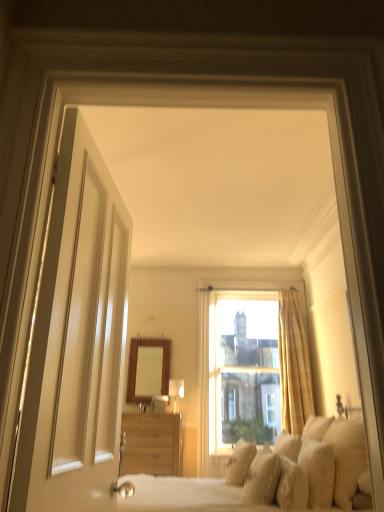
This screenshot has height=512, width=384. In order to click on white soft pillow at lower right, the 4th pillow viewed from the left in this screenshot , I will do `click(288, 445)`.

Where is `fluffy white pillow at lower center, arranged as the 6th pillow when viewed from the right`? This screenshot has width=384, height=512. fluffy white pillow at lower center, arranged as the 6th pillow when viewed from the right is located at coordinates (240, 462).

Looking at this image, how much space does white textured pillow at lower right, the 2th pillow in the right-to-left sequence, occupy horizontally?

The width of white textured pillow at lower right, the 2th pillow in the right-to-left sequence, is 8.10 inches.

What is the approximate height of soft cream pillows at center?

It is 3.51 feet.

Describe the element at coordinates (152, 444) in the screenshot. Image resolution: width=384 pixels, height=512 pixels. I see `wooden cabinet at lower center` at that location.

In order to face wooden cabinet at lower center, should I rotate leftwards or rightwards?

Turn left approximately 5.946 degrees to face it.

This screenshot has width=384, height=512. I want to click on white soft pillow at lower right, arranged as the 3th pillow when viewed from the right, so click(288, 445).

In the scene shown: Considering the positions of objects white glossy door at left and wooden frame mirror at center in the image provided, who is more to the right, white glossy door at left or wooden frame mirror at center?

From the viewer's perspective, white glossy door at left appears more on the right side.

Would you consider white glossy door at left to be distant from wooden frame mirror at center?

Yes.

From a real-world perspective, which is physically above, white glossy door at left or wooden frame mirror at center?

In real-world perspective, wooden frame mirror at center is above.

There is a fluffy white pillow at lower center, acting as the 1th pillow starting from the left. Identify the location of the 2nd pillow below it (from a real-world perspective). This screenshot has width=384, height=512. coord(292,486).

How distant is fluffy white pillow at lower right, which is counted as the 4th pillow, starting from the right, from fluffy white pillow at lower center, arranged as the 6th pillow when viewed from the right?

fluffy white pillow at lower right, which is counted as the 4th pillow, starting from the right, is 26.13 inches away from fluffy white pillow at lower center, arranged as the 6th pillow when viewed from the right.

How different are the orientations of fluffy white pillow at lower right, which is counted as the 4th pillow, starting from the right, and fluffy white pillow at lower center, arranged as the 6th pillow when viewed from the right, in degrees?

There is a 0.00278-degree angle between the facing directions of fluffy white pillow at lower right, which is counted as the 4th pillow, starting from the right, and fluffy white pillow at lower center, arranged as the 6th pillow when viewed from the right.

Considering the positions of objects fluffy white pillow at lower right, which is counted as the 4th pillow, starting from the right, and fluffy white pillow at lower center, arranged as the 6th pillow when viewed from the right, in the image provided, who is behind, fluffy white pillow at lower right, which is counted as the 4th pillow, starting from the right, or fluffy white pillow at lower center, arranged as the 6th pillow when viewed from the right,?

fluffy white pillow at lower center, arranged as the 6th pillow when viewed from the right, is more distant.

In the scene shown: Which object is positioned more to the left, white textured pillow at lower right, the 2th pillow in the right-to-left sequence, or soft white pillow at lower right, which is counted as the first pillow, starting from the right?

white textured pillow at lower right, the 2th pillow in the right-to-left sequence, is more to the left.

Is soft white pillow at lower right, the sixth pillow positioned from the left, inside white textured pillow at lower right, the 2th pillow in the right-to-left sequence?

That's incorrect, soft white pillow at lower right, the sixth pillow positioned from the left, is not inside white textured pillow at lower right, the 2th pillow in the right-to-left sequence.

Is white textured pillow at lower right, positioned as the fifth pillow in left-to-right order, closer to camera compared to soft white pillow at lower right, which is counted as the first pillow, starting from the right?

No, white textured pillow at lower right, positioned as the fifth pillow in left-to-right order, is further to the viewer.

Is white textured pillow at lower right, the 2th pillow in the right-to-left sequence, taller or shorter than soft white pillow at lower right, the sixth pillow positioned from the left?

white textured pillow at lower right, the 2th pillow in the right-to-left sequence, is taller than soft white pillow at lower right, the sixth pillow positioned from the left.

Does soft cream pillows at center turn towards matte white lampshade at center?

→ No, soft cream pillows at center does not turn towards matte white lampshade at center.

Would you say matte white lampshade at center is part of soft cream pillows at center's contents?

Actually, matte white lampshade at center is outside soft cream pillows at center.

Is soft cream pillows at center bigger than matte white lampshade at center?

Indeed, soft cream pillows at center has a larger size compared to matte white lampshade at center.

Which is closer, (264, 496) or (174, 384)?

The point (264, 496) is more forward.

Is point (294, 437) closer or farther from the camera than point (349, 484)?

Point (294, 437) is farther from the camera than point (349, 484).

Is white soft pillow at lower right, the 4th pillow viewed from the left, not close to soft white pillow at lower right, the sixth pillow positioned from the left?

They are positioned close to each other.

Is soft white pillow at lower right, which is counted as the first pillow, starting from the right, surrounded by white soft pillow at lower right, arranged as the 3th pillow when viewed from the right?

Actually, soft white pillow at lower right, which is counted as the first pillow, starting from the right, is outside white soft pillow at lower right, arranged as the 3th pillow when viewed from the right.

From a real-world perspective, between wooden frame mirror at center and wooden cabinet at lower center, who is vertically higher?

wooden frame mirror at center, from a real-world perspective.

From the image's perspective, is wooden frame mirror at center over wooden cabinet at lower center?

Yes, from the image's perspective, wooden frame mirror at center is above wooden cabinet at lower center.

How different are the orientations of wooden frame mirror at center and wooden cabinet at lower center in degrees?

There is a 2.58-degree angle between the facing directions of wooden frame mirror at center and wooden cabinet at lower center.

Would you say wooden frame mirror at center is inside or outside wooden cabinet at lower center?

wooden frame mirror at center is not inside wooden cabinet at lower center, it's outside.

Locate an element on the screen. The height and width of the screenshot is (512, 384). the 5th pillow to the right when counting from the wooden frame mirror at center is located at coordinates (318, 472).

Between white textured pillow at lower right, positioned as the fifth pillow in left-to-right order, and wooden frame mirror at center, which one is positioned behind?

wooden frame mirror at center is behind.

Is point (317, 473) positioned in front of point (144, 381)?

Yes, it is in front of point (144, 381).

Who is bigger, white textured pillow at lower right, positioned as the fifth pillow in left-to-right order, or wooden frame mirror at center?

With larger size is wooden frame mirror at center.

Locate an element on the screen. door that appears below the wooden frame mirror at center (from a real-world perspective) is located at coordinates (78, 328).

Where is `the 2nd pillow to the right when counting from the fluffy white pillow at lower center, acting as the 1th pillow starting from the left`? the 2nd pillow to the right when counting from the fluffy white pillow at lower center, acting as the 1th pillow starting from the left is located at coordinates (292, 486).

Estimate the real-world distances between objects in this image. Which object is further from clear glass window at center, wooden cabinet at lower center or fluffy white pillow at lower center, acting as the 1th pillow starting from the left?

fluffy white pillow at lower center, acting as the 1th pillow starting from the left, is positioned further to the anchor clear glass window at center.

Considering their positions, is soft cream pillows at center positioned further to clear glass window at center than fluffy white pillow at lower right, which is counted as the 4th pillow, starting from the right?

Among the two, fluffy white pillow at lower right, which is counted as the 4th pillow, starting from the right, is located further to clear glass window at center.

Which object lies nearer to the anchor point white glossy door at left, clear glass window at center or clear glass window at center?

clear glass window at center lies closer to white glossy door at left than the other object.

Considering their positions, is white textured pillow at lower right, positioned as the fifth pillow in left-to-right order, positioned further to soft beige pillow at lower right, placed as the fifth pillow when sorted from right to left, than clear glass window at center?

clear glass window at center is further to soft beige pillow at lower right, placed as the fifth pillow when sorted from right to left.

From the image, which object appears to be nearer to clear glass window at center, soft beige pillow at lower right, acting as the second pillow starting from the left, or soft white pillow at lower right, which is counted as the first pillow, starting from the right?

soft beige pillow at lower right, acting as the second pillow starting from the left, lies closer to clear glass window at center than the other object.

In the scene shown: Looking at the image, which one is located closer to wooden frame mirror at center, matte white lampshade at center or white glossy door at left?

matte white lampshade at center lies closer to wooden frame mirror at center than the other object.

From the image, which object appears to be nearer to soft cream pillows at center, white textured pillow at lower right, the 2th pillow in the right-to-left sequence, or fluffy white pillow at lower right, which is counted as the 4th pillow, starting from the right?

Based on the image, fluffy white pillow at lower right, which is counted as the 4th pillow, starting from the right, appears to be nearer to soft cream pillows at center.

From the image, which object appears to be farther from soft white pillow at lower right, which is counted as the first pillow, starting from the right, white soft pillow at lower right, arranged as the 3th pillow when viewed from the right, or soft cream pillows at center?

soft cream pillows at center lies further to soft white pillow at lower right, which is counted as the first pillow, starting from the right, than the other object.

What are the coordinates of `lamp between white glossy door at left and wooden frame mirror at center along the z-axis` in the screenshot? It's located at click(175, 393).

Identify the location of window between white glossy door at left and matte white lampshade at center along the z-axis. (252, 368).

Locate an element on the screen. Image resolution: width=384 pixels, height=512 pixels. lamp between wooden frame mirror at center and clear glass window at center is located at coordinates (175, 393).

Locate an element on the screen. The height and width of the screenshot is (512, 384). curtain positioned between white glossy door at left and matte white lampshade at center from near to far is located at coordinates (293, 364).